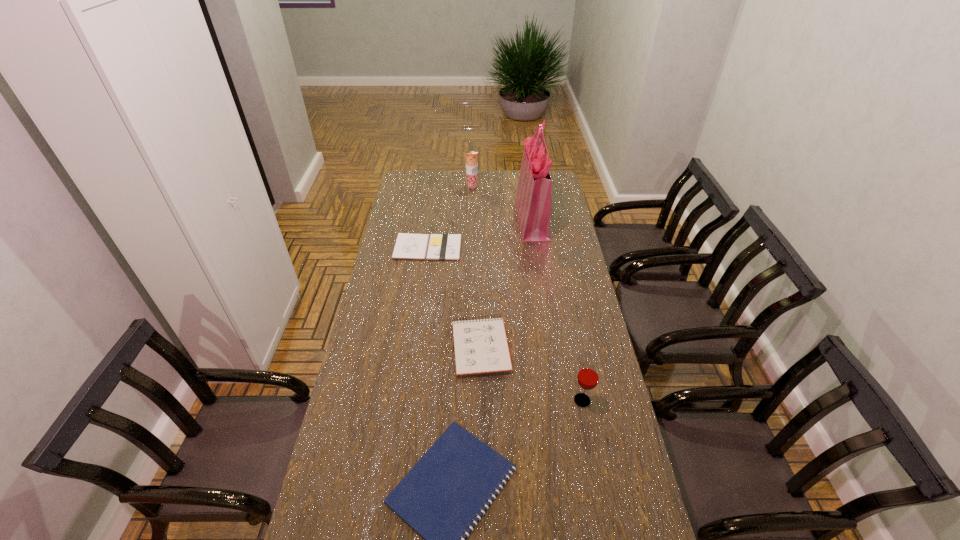
Locate an element on the screen. This screenshot has width=960, height=540. object that ranks as the fourth closest to the shopping bag is located at coordinates (588, 376).

Select which object is the fifth closest to the glass. Please provide its 2D coordinates. Your answer should be formatted as a tuple, i.e. [(x, y)], where the tuple contains the x and y coordinates of a point satisfying the conditions above.

[(471, 158)]

Find the location of `notepad that stands as the third closest to the third tallest object`. notepad that stands as the third closest to the third tallest object is located at coordinates (407, 246).

At what (x,y) coordinates should I click in order to perform the action: click on notepad that is the second closest one to the nearest notepad. Please return your answer as a coordinate pair (x, y). Looking at the image, I should click on coord(407,246).